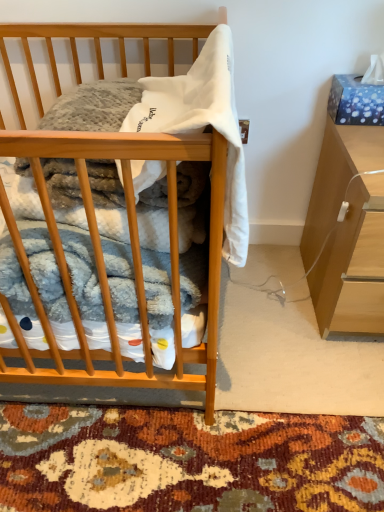
Question: Is point (210, 73) closer or farther from the camera than point (210, 365)?

Choices:
 (A) closer
 (B) farther

Answer: (A)

Question: From a real-world perspective, is white soft fabric at center physically located above or below wooden desk at center?

Choices:
 (A) below
 (B) above

Answer: (B)

Question: Which of these objects is positioned farthest from the light brown wood cabinet at right?

Choices:
 (A) wooden desk at center
 (B) white soft fabric at center

Answer: (A)

Question: Which of these objects is positioned closest to the light brown wood cabinet at right?

Choices:
 (A) white soft fabric at center
 (B) wooden desk at center

Answer: (A)